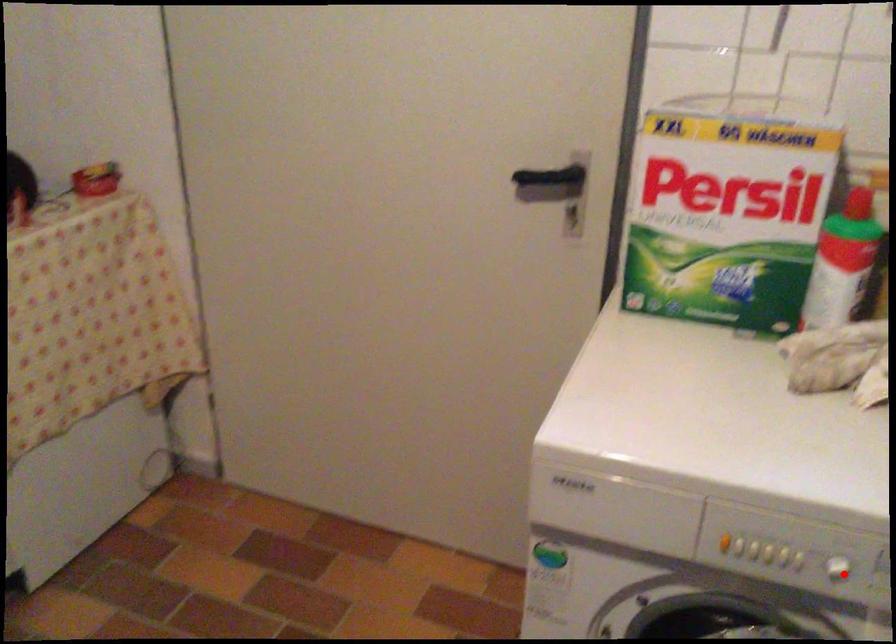
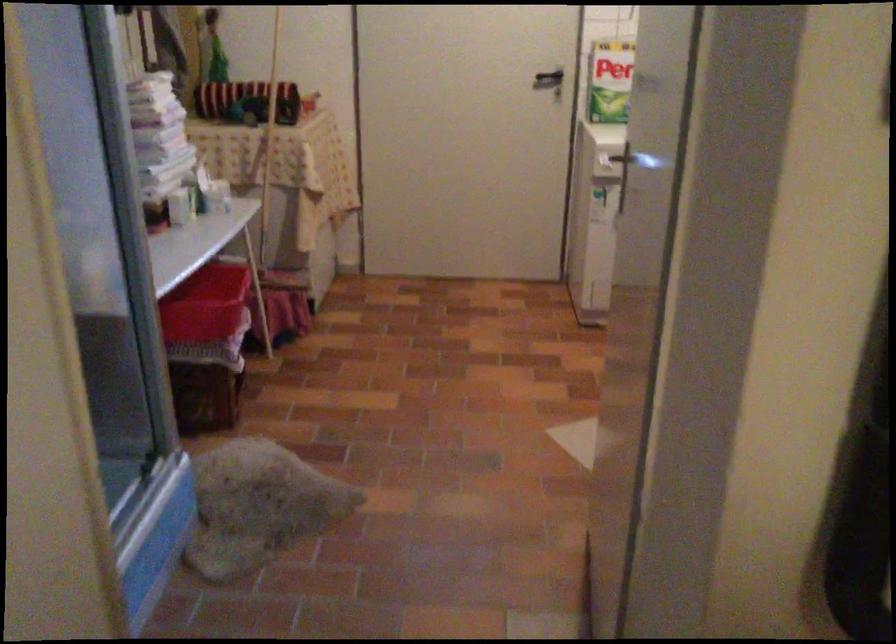
Question: I am providing you with two images of the same scene from different viewpoints. A red point is marked on the first image. Can you still see the location of the red point in image 2?

Choices:
 (A) Yes
 (B) No

Answer: (B)